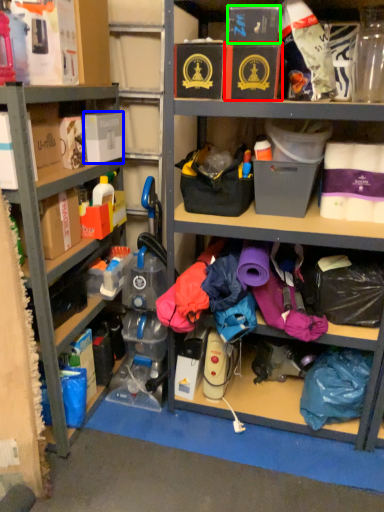
Question: Based on their relative distances, which object is farther from storage box (highlighted by a red box)? Choose from storage box (highlighted by a blue box) and storage box (highlighted by a green box).

Choices:
 (A) storage box
 (B) storage box

Answer: (A)